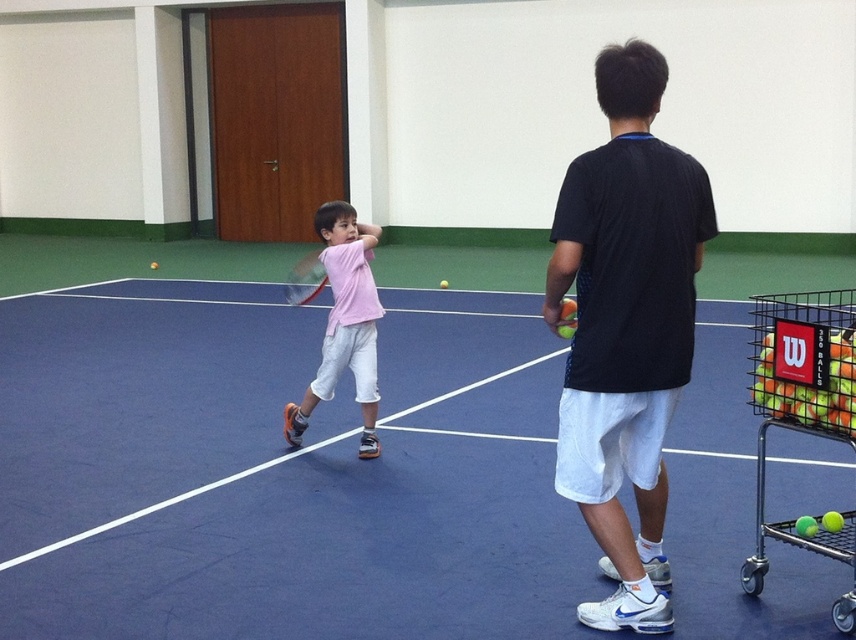
You are a tennis instructor standing at the blue synthetic tennis court at center. You need to retrieve a tennis ball from the green rubber tennis ball cart at right. Can you walk directly to the cart without stepping outside the court?

The distance between the blue synthetic tennis court at center and the green rubber tennis ball cart at right is 3.69 meters. Since the court is the blue area, you can walk directly to the cart as long as the path stays within the court boundaries. However, the description does not specify the court dimensions, so it is assumed the cart is positioned within the court area.

You are a tennis instructor standing near the green rubber tennis ball cart at right. You want to toss a tennis ball to the child holding the matte pink racket at center. Can you throw the ball from your position to reach the child without it bouncing first? Consider the distance between the two objects.

The distance between the green rubber tennis ball cart at right and the matte pink racket at center is 6.53 meters. Since the average throw distance for a tennis ball without bouncing is typically around 5 to 6 meters, the ball would likely bounce before reaching the child. Therefore, it might be challenging to toss the ball that far without it bouncing first.